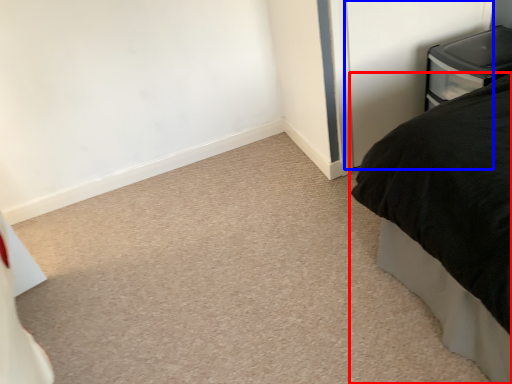
Question: Among these objects, which one is nearest to the camera, bed (highlighted by a red box) or screen door (highlighted by a blue box)?

Choices:
 (A) bed
 (B) screen door

Answer: (A)